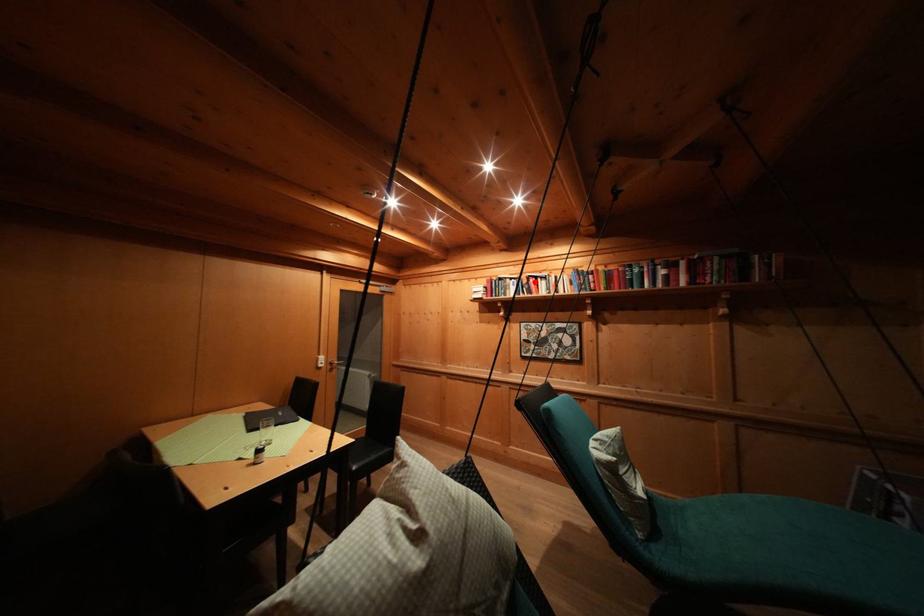
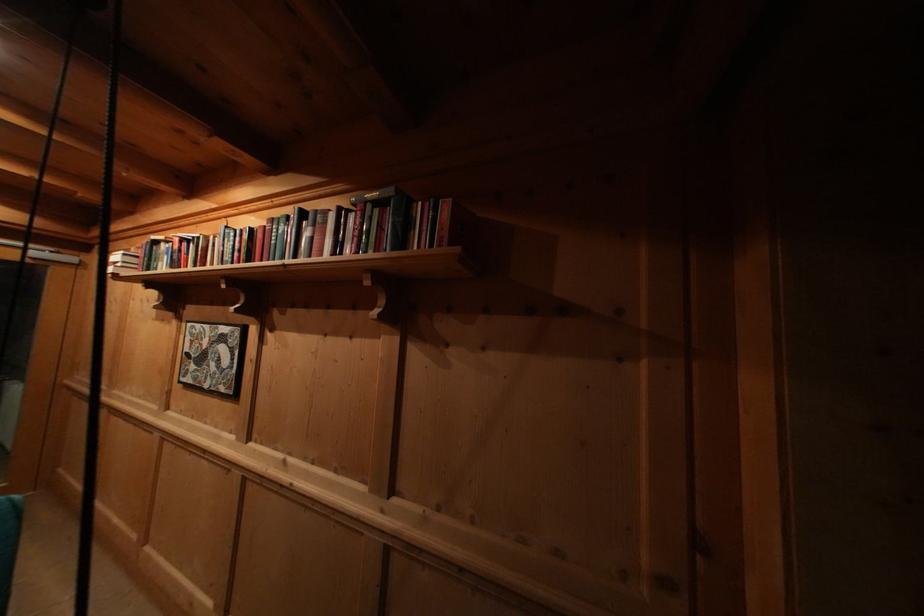
The point at the highlighted location is marked in the first image. Where is the corresponding point in the second image?

(188, 246)